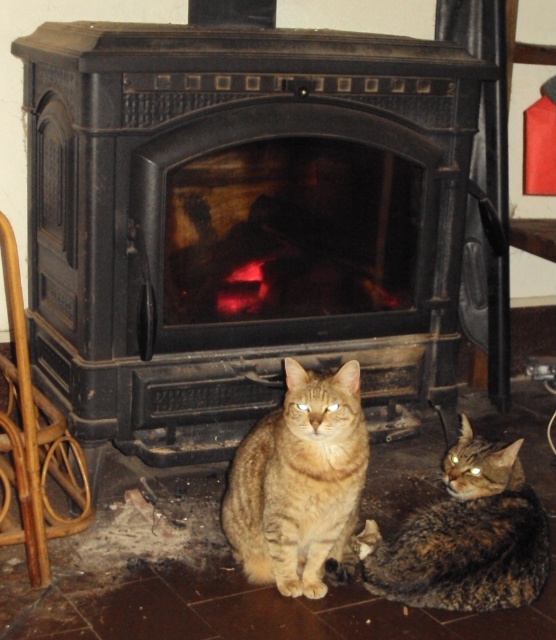
Does black matte fireplace at center have a lesser width compared to tabby fur cat at center?

In fact, black matte fireplace at center might be wider than tabby fur cat at center.

Can you confirm if black matte fireplace at center is bigger than tabby fur cat at center?

Yes.

You are a GUI agent. You are given a task and a screenshot of the screen. Output one action in this format:
    pyautogui.click(x=<x>, y=<y>)
    Task: Click on the black matte fireplace at center
    This screenshot has width=556, height=640.
    Given the screenshot: What is the action you would take?
    pyautogui.click(x=240, y=220)

How far apart are tabby fur cat at center and tabby fur cat at lower center?

11.48 inches

Who is more forward, (326,387) or (449,552)?

Point (326,387)

Locate an element on the screen. This screenshot has height=640, width=556. tabby fur cat at center is located at coordinates (299, 481).

Is the position of black matte fireplace at center more distant than that of tabby fur cat at lower center?

That is True.

Can you confirm if black matte fireplace at center is positioned to the left of tabby fur cat at lower center?

Yes, black matte fireplace at center is to the left of tabby fur cat at lower center.

Does point (57, 392) lie behind point (466, 493)?

Yes, it is.

At what (x,y) coordinates should I click in order to perform the action: click on black matte fireplace at center. Please return your answer as a coordinate pair (x, y). Looking at the image, I should click on (240, 220).